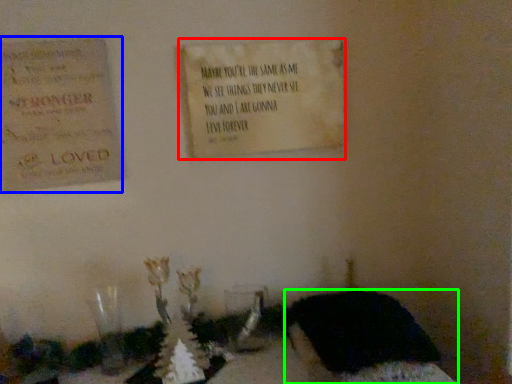
Question: Which is nearer to the notice (highlighted by a red box)? cardboard (highlighted by a blue box) or furniture (highlighted by a green box).

Choices:
 (A) cardboard
 (B) furniture

Answer: (A)